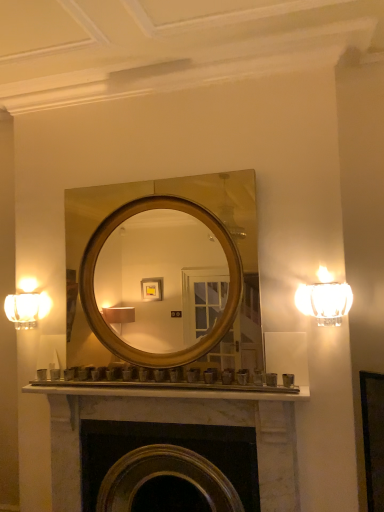
Question: From the image's perspective, is clear glass sconce at right located above or below gold/metallic mirror at center?

Choices:
 (A) above
 (B) below

Answer: (B)

Question: Considering the positions of point (301, 307) and point (87, 355), is point (301, 307) closer or farther from the camera than point (87, 355)?

Choices:
 (A) closer
 (B) farther

Answer: (A)

Question: Considering the real-world distances, which object is farthest from the matte glass sconce at left?

Choices:
 (A) marble fireplace at center
 (B) gold/metallic mirror at center
 (C) clear glass sconce at right

Answer: (C)

Question: Which is farther from the gold/metallic mirror at center?

Choices:
 (A) marble fireplace at center
 (B) matte glass sconce at left
 (C) clear glass sconce at right

Answer: (A)